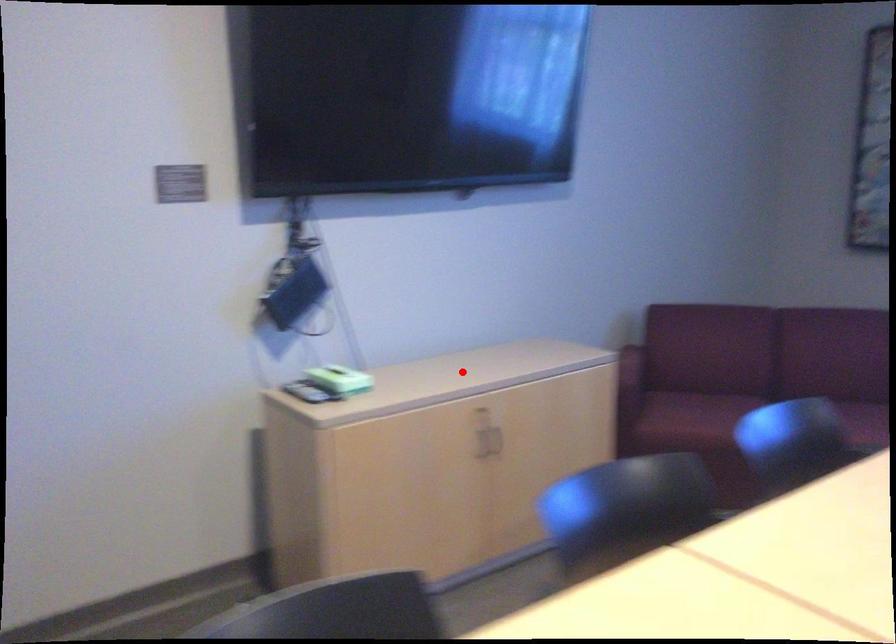
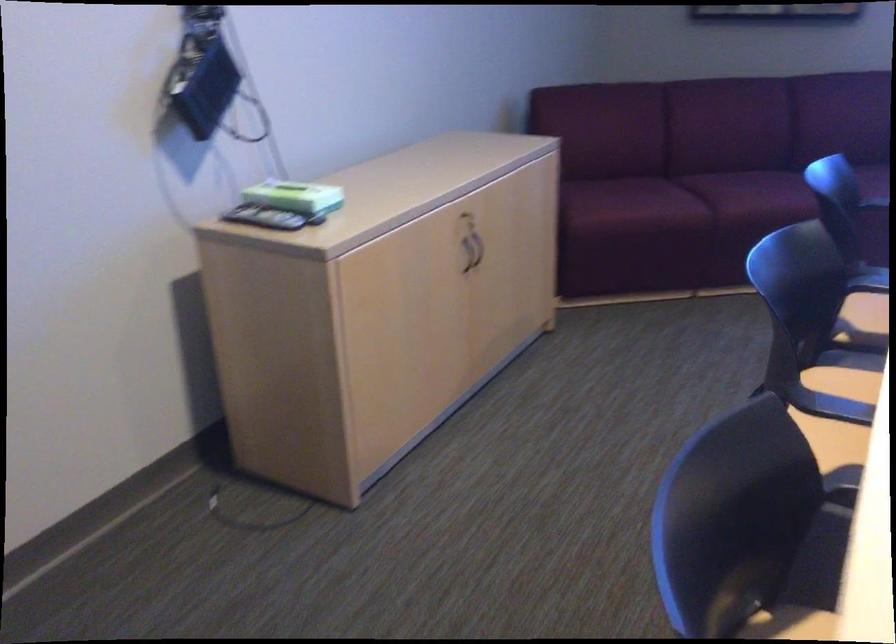
Question: I am providing you with two images of the same scene from different viewpoints. Image1 has a red point marked. In image2, the corresponding 3D location appears at what relative position? Reply with the corresponding letter.

Choices:
 (A) Closer
 (B) Farther

Answer: (A)